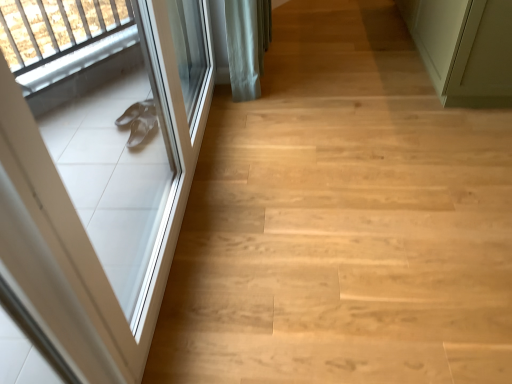
Question: Is green matte door at upper right, the 1th door when ordered from right to left, to the left of light wood floor at left from the viewer's perspective?

Choices:
 (A) yes
 (B) no

Answer: (B)

Question: From a real-world perspective, is green matte door at upper right, the 1th door when ordered from right to left, on top of light wood floor at left?

Choices:
 (A) yes
 (B) no

Answer: (A)

Question: Does green matte door at upper right, which is the second door from left to right, have a greater width compared to light wood floor at left?

Choices:
 (A) no
 (B) yes

Answer: (A)

Question: Does green matte door at upper right, the 1th door when ordered from right to left, come in front of light wood floor at left?

Choices:
 (A) yes
 (B) no

Answer: (B)

Question: Considering the relative sizes of green matte door at upper right, which is the second door from left to right, and light wood floor at left in the image provided, is green matte door at upper right, which is the second door from left to right, thinner than light wood floor at left?

Choices:
 (A) yes
 (B) no

Answer: (A)

Question: Are green matte door at upper right, which is the second door from left to right, and light wood floor at left making contact?

Choices:
 (A) yes
 (B) no

Answer: (B)

Question: Can you confirm if white glossy door at left, marked as the 1th door in a left-to-right arrangement, is bigger than light wood floor at left?

Choices:
 (A) no
 (B) yes

Answer: (A)

Question: Does white glossy door at left, marked as the 1th door in a left-to-right arrangement, turn towards light wood floor at left?

Choices:
 (A) yes
 (B) no

Answer: (A)

Question: Is white glossy door at left, marked as the 1th door in a left-to-right arrangement, turned away from light wood floor at left?

Choices:
 (A) yes
 (B) no

Answer: (B)

Question: Is white glossy door at left, which ranks as the 2th door in right-to-left order, closer to camera compared to light wood floor at left?

Choices:
 (A) no
 (B) yes

Answer: (B)

Question: From the image's perspective, would you say white glossy door at left, marked as the 1th door in a left-to-right arrangement, is positioned over light wood floor at left?

Choices:
 (A) yes
 (B) no

Answer: (B)

Question: Is white glossy door at left, marked as the 1th door in a left-to-right arrangement, surrounding light wood floor at left?

Choices:
 (A) no
 (B) yes

Answer: (A)

Question: From the image's perspective, is light wood floor at left on top of white glossy door at left, which ranks as the 2th door in right-to-left order?

Choices:
 (A) yes
 (B) no

Answer: (A)